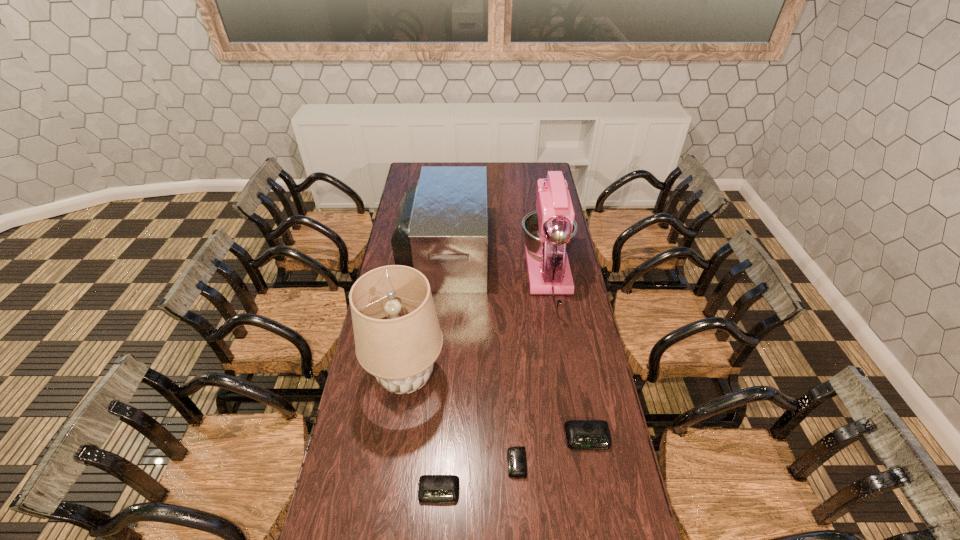
Locate an element on the screen. This screenshot has width=960, height=540. the second shortest alarm clock is located at coordinates (433, 489).

Identify the location of the leftmost alarm clock. The image size is (960, 540). (433, 489).

Identify the location of the second alarm clock from right to left. (516, 456).

Identify the location of the shortest object. (516, 456).

Identify the location of the rightmost alarm clock. (580, 434).

The image size is (960, 540). In order to click on the fourth tallest object in this screenshot , I will do `click(580, 434)`.

You are a GUI agent. You are given a task and a screenshot of the screen. Output one action in this format:
    pyautogui.click(x=<x>, y=<y>)
    Task: Click on the third tallest object
    The height and width of the screenshot is (540, 960).
    Given the screenshot: What is the action you would take?
    pyautogui.click(x=441, y=230)

Identify the location of mixer. (548, 232).

Where is `the third farthest object`? The height and width of the screenshot is (540, 960). the third farthest object is located at coordinates (400, 351).

At what (x,y) coordinates should I click in order to perform the action: click on free space located on the display of the second alarm clock from right to left. Please return your answer as a coordinate pair (x, y). The width and height of the screenshot is (960, 540). Looking at the image, I should click on (485, 463).